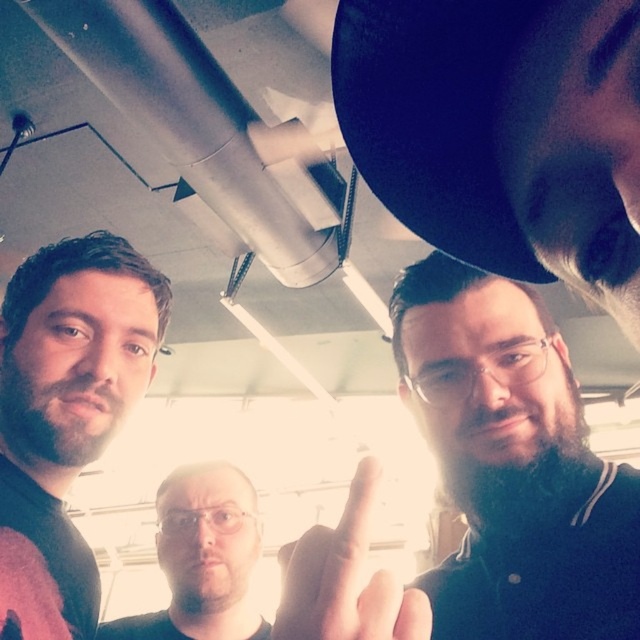
Question: Does dark brown hair at upper center have a smaller size compared to matte black shirt at left?

Choices:
 (A) yes
 (B) no

Answer: (A)

Question: Is dark brown hair at upper center closer to camera compared to clear plastic glasses at center?

Choices:
 (A) no
 (B) yes

Answer: (B)

Question: Which object is positioned closest to the matte black shirt at left?

Choices:
 (A) matte skin hand at center
 (B) clear plastic glasses at center

Answer: (A)

Question: Which object is the farthest from the matte skin hand at center?

Choices:
 (A) matte black shirt at left
 (B) dark brown hair at upper center

Answer: (A)

Question: Which of the following is the closest to the observer?

Choices:
 (A) clear plastic glasses at center
 (B) matte black shirt at left

Answer: (B)

Question: Is matte black shirt at left bigger than clear plastic glasses at center?

Choices:
 (A) no
 (B) yes

Answer: (B)